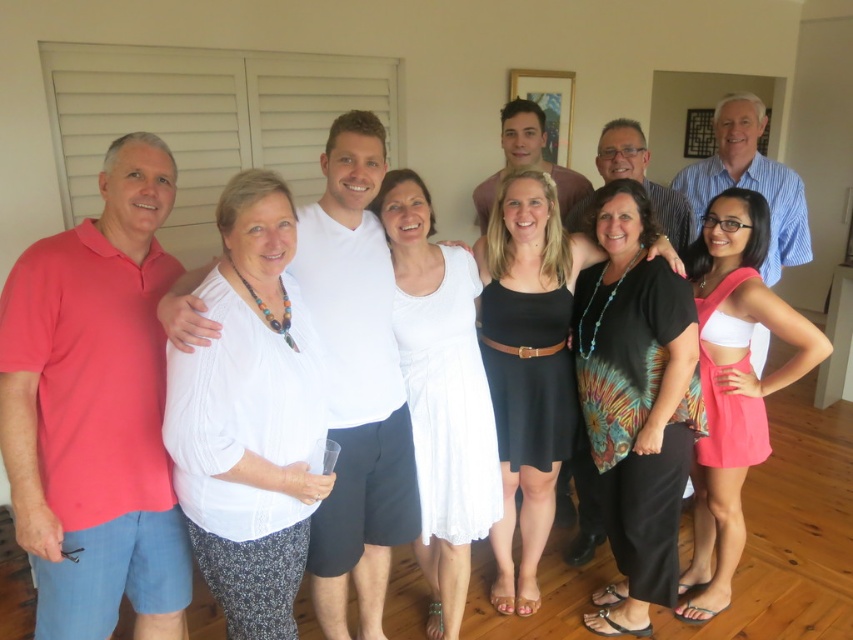
Who is higher up, white cotton blouse at center or pink satin dress at lower right?

white cotton blouse at center is above.

Can you confirm if white cotton blouse at center is bigger than pink satin dress at lower right?

Actually, white cotton blouse at center might be smaller than pink satin dress at lower right.

Where is `white cotton blouse at center`? Image resolution: width=853 pixels, height=640 pixels. white cotton blouse at center is located at coordinates (248, 419).

Between white cotton dress at center and pink satin dress at lower right, which one appears on the left side from the viewer's perspective?

From the viewer's perspective, white cotton dress at center appears more on the left side.

What do you see at coordinates (440, 394) in the screenshot? I see `white cotton dress at center` at bounding box center [440, 394].

Is point (457, 380) positioned behind point (679, 589)?

No, it is not.

You are a GUI agent. You are given a task and a screenshot of the screen. Output one action in this format:
    pyautogui.click(x=<x>, y=<y>)
    Task: Click on the white cotton dress at center
    The height and width of the screenshot is (640, 853).
    Given the screenshot: What is the action you would take?
    pyautogui.click(x=440, y=394)

Who is shorter, white cotton blouse at center or black tie-dye blouse at center?

white cotton blouse at center is shorter.

Locate an element on the screen. white cotton blouse at center is located at coordinates (248, 419).